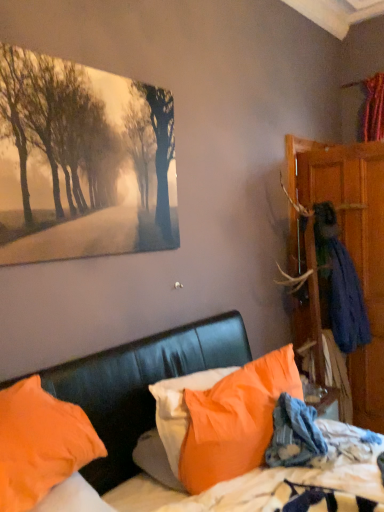
This screenshot has width=384, height=512. What do you see at coordinates (341, 289) in the screenshot?
I see `blue fabric coat at right` at bounding box center [341, 289].

I want to click on orange fabric pillow at center, the second pillow when ordered from right to left, so (179, 408).

This screenshot has height=512, width=384. What are the coordinates of `orange fabric pillow at lower left, placed as the first pillow when sorted from left to right` in the screenshot? It's located at (x=40, y=443).

Find the location of a particular element. Image resolution: width=384 pixels, height=512 pixels. blue fabric coat at right is located at coordinates 341,289.

Who is smaller, orange fabric pillow at center, which ranks as the 3th pillow in left-to-right order, or matte canvas painting at upper left?

matte canvas painting at upper left is smaller.

I want to click on picture frame above the orange fabric pillow at center, positioned as the 1th pillow in right-to-left order (from the image's perspective), so click(82, 162).

From the image's perspective, between orange fabric pillow at center, which ranks as the 3th pillow in left-to-right order, and matte canvas painting at upper left, who is located below?

orange fabric pillow at center, which ranks as the 3th pillow in left-to-right order.

Which object is positioned more to the right, orange fabric pillow at center, which ranks as the 3th pillow in left-to-right order, or matte canvas painting at upper left?

orange fabric pillow at center, which ranks as the 3th pillow in left-to-right order, is more to the right.

Which object is wider, orange fabric pillow at lower left, the 3th pillow viewed from the right, or orange fabric pillow at center, which ranks as the 3th pillow in left-to-right order?

orange fabric pillow at lower left, the 3th pillow viewed from the right.

From the picture: Would you consider orange fabric pillow at lower left, the 3th pillow viewed from the right, to be distant from orange fabric pillow at center, positioned as the 1th pillow in right-to-left order?

That's not correct — orange fabric pillow at lower left, the 3th pillow viewed from the right, is a little close to orange fabric pillow at center, positioned as the 1th pillow in right-to-left order.

From the picture: Considering the sizes of objects orange fabric pillow at lower left, placed as the first pillow when sorted from left to right, and orange fabric pillow at center, positioned as the 1th pillow in right-to-left order, in the image provided, who is shorter, orange fabric pillow at lower left, placed as the first pillow when sorted from left to right, or orange fabric pillow at center, positioned as the 1th pillow in right-to-left order,?

orange fabric pillow at lower left, placed as the first pillow when sorted from left to right.

From a real-world perspective, is orange fabric pillow at lower left, the 3th pillow viewed from the right, positioned above or below orange fabric pillow at center, which ranks as the 3th pillow in left-to-right order?

Clearly, from a real-world perspective, orange fabric pillow at lower left, the 3th pillow viewed from the right, is above orange fabric pillow at center, which ranks as the 3th pillow in left-to-right order.

From a real-world perspective, is blue fabric coat at right beneath orange fabric pillow at lower left, placed as the first pillow when sorted from left to right?

Incorrect, from a real-world perspective, blue fabric coat at right is higher than orange fabric pillow at lower left, placed as the first pillow when sorted from left to right.

Can you confirm if blue fabric coat at right is positioned to the left of orange fabric pillow at lower left, placed as the first pillow when sorted from left to right?

Incorrect, blue fabric coat at right is not on the left side of orange fabric pillow at lower left, placed as the first pillow when sorted from left to right.

Which is behind, blue fabric coat at right or orange fabric pillow at lower left, the 3th pillow viewed from the right?

blue fabric coat at right is further from the camera.

Is point (339, 288) farther from camera compared to point (57, 444)?

Yes, point (339, 288) is behind point (57, 444).

You are a GUI agent. You are given a task and a screenshot of the screen. Output one action in this format:
    pyautogui.click(x=<x>, y=<y>)
    Task: Click on the dresser above the orange fabric pillow at center, the second pillow when ordered from right to left (from the image's perspective)
    This screenshot has height=512, width=384.
    Given the screenshot: What is the action you would take?
    pyautogui.click(x=351, y=244)

From the image's perspective, between orange fabric pillow at center, the second pillow when ordered from left to right, and wooden wardrobe at right, which one is located above?

wooden wardrobe at right.

Is orange fabric pillow at center, the second pillow when ordered from right to left, wider than wooden wardrobe at right?

No, orange fabric pillow at center, the second pillow when ordered from right to left, is not wider than wooden wardrobe at right.

From a real-world perspective, is orange fabric pillow at center, the second pillow when ordered from right to left, physically above wooden wardrobe at right?

Incorrect, from a real-world perspective, orange fabric pillow at center, the second pillow when ordered from right to left, is lower than wooden wardrobe at right.

Is orange fabric pillow at lower left, the 3th pillow viewed from the right, beside wooden wardrobe at right?

No, orange fabric pillow at lower left, the 3th pillow viewed from the right, is not touching wooden wardrobe at right.

From a real-world perspective, is orange fabric pillow at lower left, placed as the first pillow when sorted from left to right, physically located above or below wooden wardrobe at right?

Clearly, from a real-world perspective, orange fabric pillow at lower left, placed as the first pillow when sorted from left to right, is below wooden wardrobe at right.

Considering the relative sizes of orange fabric pillow at lower left, placed as the first pillow when sorted from left to right, and wooden wardrobe at right in the image provided, is orange fabric pillow at lower left, placed as the first pillow when sorted from left to right, thinner than wooden wardrobe at right?

Indeed, orange fabric pillow at lower left, placed as the first pillow when sorted from left to right, has a lesser width compared to wooden wardrobe at right.

Do you think orange fabric pillow at lower left, placed as the first pillow when sorted from left to right, is within wooden wardrobe at right, or outside of it?

orange fabric pillow at lower left, placed as the first pillow when sorted from left to right, lies outside wooden wardrobe at right.

From the picture: Does wooden wardrobe at right have a smaller size compared to matte canvas painting at upper left?

No.

From a real-world perspective, is wooden wardrobe at right physically below matte canvas painting at upper left?

Yes, from a real-world perspective, wooden wardrobe at right is beneath matte canvas painting at upper left.

Can you tell me how much wooden wardrobe at right and matte canvas painting at upper left differ in facing direction?

The angle between the facing direction of wooden wardrobe at right and the facing direction of matte canvas painting at upper left is 0.00554 degrees.

Would you say wooden wardrobe at right is a long distance from matte canvas painting at upper left?

Yes, wooden wardrobe at right and matte canvas painting at upper left are quite far apart.

Is orange fabric pillow at center, which ranks as the 3th pillow in left-to-right order, facing away from orange fabric pillow at center, the second pillow when ordered from left to right?

Yes.

Is orange fabric pillow at center, positioned as the 1th pillow in right-to-left order, next to orange fabric pillow at center, the second pillow when ordered from left to right, and touching it?

No, orange fabric pillow at center, positioned as the 1th pillow in right-to-left order, is not with orange fabric pillow at center, the second pillow when ordered from left to right.

Does orange fabric pillow at center, which ranks as the 3th pillow in left-to-right order, have a larger size compared to orange fabric pillow at center, the second pillow when ordered from right to left?

Yes, orange fabric pillow at center, which ranks as the 3th pillow in left-to-right order, is bigger than orange fabric pillow at center, the second pillow when ordered from right to left.

Which object is thinner, orange fabric pillow at center, which ranks as the 3th pillow in left-to-right order, or orange fabric pillow at center, the second pillow when ordered from left to right?

orange fabric pillow at center, the second pillow when ordered from left to right.

At what (x,y) coordinates should I click in order to perform the action: click on picture frame that appears behind the orange fabric pillow at center, positioned as the 1th pillow in right-to-left order. Please return your answer as a coordinate pair (x, y). Looking at the image, I should click on (82, 162).

Starting from the orange fabric pillow at center, positioned as the 1th pillow in right-to-left order, which pillow is the 2nd one to the left? Please provide its 2D coordinates.

[(40, 443)]

Considering their positions, is orange fabric pillow at lower left, placed as the first pillow when sorted from left to right, positioned further to blue fabric coat at right than wooden wardrobe at right?

Among the two, orange fabric pillow at lower left, placed as the first pillow when sorted from left to right, is located further to blue fabric coat at right.

When comparing their distances from orange fabric pillow at lower left, the 3th pillow viewed from the right, does orange fabric pillow at center, the second pillow when ordered from right to left, or matte canvas painting at upper left seem further?

matte canvas painting at upper left is further to orange fabric pillow at lower left, the 3th pillow viewed from the right.

From the image, which object appears to be farther from wooden wardrobe at right, orange fabric pillow at lower left, the 3th pillow viewed from the right, or orange fabric pillow at center, positioned as the 1th pillow in right-to-left order?

orange fabric pillow at lower left, the 3th pillow viewed from the right.

Which object lies further to the anchor point wooden wardrobe at right, blue fabric coat at right or orange fabric pillow at center, positioned as the 1th pillow in right-to-left order?

orange fabric pillow at center, positioned as the 1th pillow in right-to-left order, is further to wooden wardrobe at right.

Based on their spatial positions, is orange fabric pillow at center, the second pillow when ordered from left to right, or wooden wardrobe at right further from matte canvas painting at upper left?

The object further to matte canvas painting at upper left is wooden wardrobe at right.

Considering their positions, is orange fabric pillow at lower left, the 3th pillow viewed from the right, positioned closer to wooden wardrobe at right than orange fabric pillow at center, the second pillow when ordered from left to right?

orange fabric pillow at center, the second pillow when ordered from left to right.

Which object lies nearer to the anchor point orange fabric pillow at center, positioned as the 1th pillow in right-to-left order, wooden wardrobe at right or matte canvas painting at upper left?

matte canvas painting at upper left.

When comparing their distances from blue fabric coat at right, does orange fabric pillow at lower left, placed as the first pillow when sorted from left to right, or orange fabric pillow at center, positioned as the 1th pillow in right-to-left order, seem further?

Based on the image, orange fabric pillow at lower left, placed as the first pillow when sorted from left to right, appears to be further to blue fabric coat at right.

At what (x,y) coordinates should I click in order to perform the action: click on dresser located between orange fabric pillow at center, positioned as the 1th pillow in right-to-left order, and blue fabric coat at right in the depth direction. Please return your answer as a coordinate pair (x, y). Looking at the image, I should click on (351, 244).

Where is `picture frame between orange fabric pillow at lower left, the 3th pillow viewed from the right, and wooden wardrobe at right from left to right`? The height and width of the screenshot is (512, 384). picture frame between orange fabric pillow at lower left, the 3th pillow viewed from the right, and wooden wardrobe at right from left to right is located at coordinates (82, 162).

The image size is (384, 512). I want to click on picture frame between orange fabric pillow at center, positioned as the 1th pillow in right-to-left order, and blue fabric coat at right from front to back, so click(82, 162).

Find the location of a particular element. pillow located between orange fabric pillow at center, positioned as the 1th pillow in right-to-left order, and blue fabric coat at right in the depth direction is located at coordinates (179, 408).